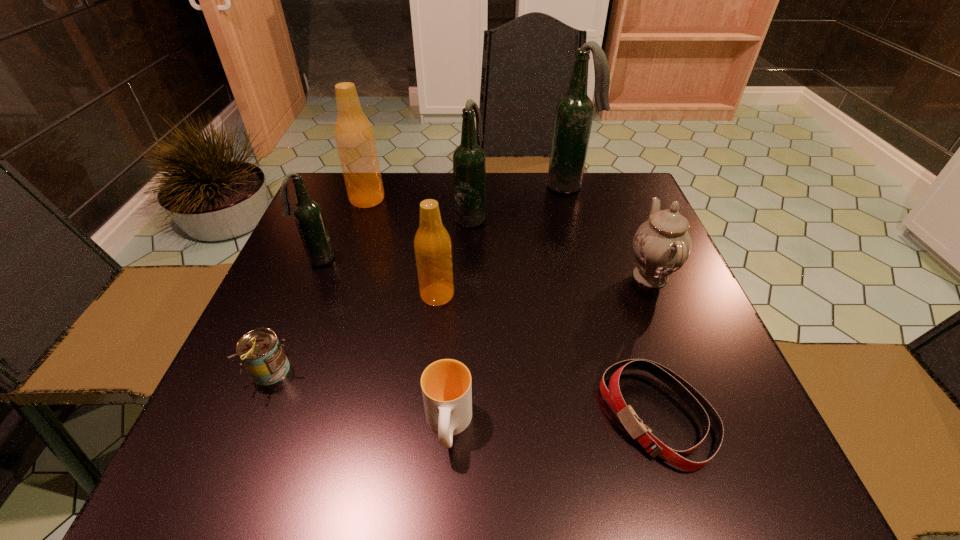
Find the location of `vacant space at the far right corner`. vacant space at the far right corner is located at coordinates (612, 192).

I want to click on vacant space at the near right corner, so click(713, 470).

Where is `unoccupied area between the nearest dark beer bottle and the pink dog collar`? This screenshot has width=960, height=540. unoccupied area between the nearest dark beer bottle and the pink dog collar is located at coordinates (488, 339).

Locate an element on the screen. vacant space in between the fourth shortest object and the second nearest dark beer bottle is located at coordinates (561, 246).

Where is `empty space that is in between the yellow cup and the second biggest dark beer bottle`? empty space that is in between the yellow cup and the second biggest dark beer bottle is located at coordinates (460, 321).

This screenshot has height=540, width=960. In order to click on vacant region between the seventh tallest object and the fourth shortest object in this screenshot , I will do `click(461, 324)`.

Find the location of a particular element. Image resolution: width=960 pixels, height=540 pixels. empty space between the second smallest dark beer bottle and the farther tan beer bottle is located at coordinates (419, 208).

Identify the location of unoccupied position between the bigger tan beer bottle and the second dark beer bottle from left to right. (419, 208).

Where is `free space between the nearer tan beer bottle and the left tan beer bottle`? free space between the nearer tan beer bottle and the left tan beer bottle is located at coordinates (402, 247).

Image resolution: width=960 pixels, height=540 pixels. I want to click on free space between the second biggest dark beer bottle and the smallest dark beer bottle, so click(x=395, y=238).